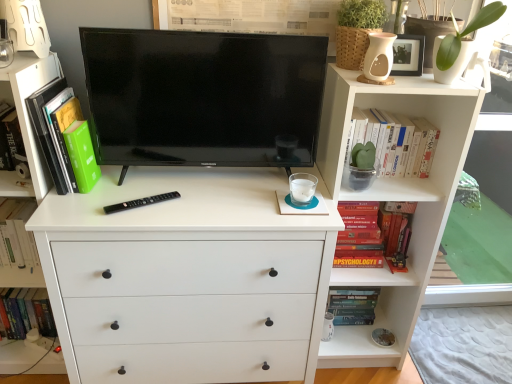
Where is `free point below black glossy tv at center (from a real-world perspective)`? free point below black glossy tv at center (from a real-world perspective) is located at coordinates (207, 182).